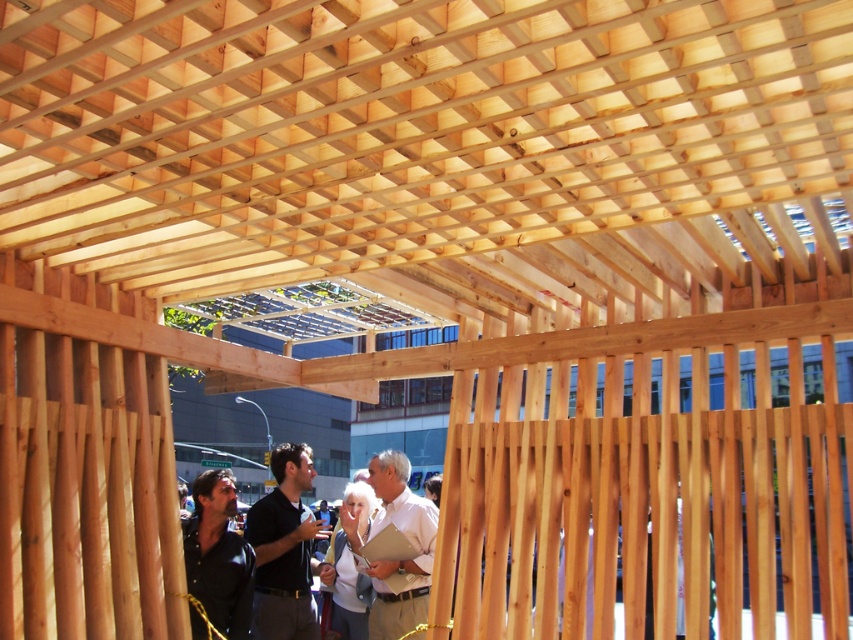
Between black shirt at center and dark brown leather jacket at lower left, which one appears on the right side from the viewer's perspective?

Positioned to the right is black shirt at center.

Measure the distance between point (256, 570) and camera.

Point (256, 570) is 6.52 meters from camera.

Does point (259, 506) lie behind point (221, 596)?

Yes, it is.

What are the coordinates of `black shirt at center` in the screenshot? It's located at click(x=283, y=548).

At what (x,y) coordinates should I click in order to perform the action: click on white matte shirt at center. Please return your answer as a coordinate pair (x, y). Looking at the image, I should click on (399, 560).

Is white matte shirt at center in front of dark brown leather jacket at lower left?

No, white matte shirt at center is further to the viewer.

Is point (376, 593) behind point (223, 540)?

That is True.

Where is `white matte shirt at center`? white matte shirt at center is located at coordinates (399, 560).

Who is positioned more to the right, black shirt at center or white matte shirt at center?

white matte shirt at center

Is black shirt at center behind white matte shirt at center?

No, it is not.

Is point (251, 508) positioned before point (410, 580)?

No, it is behind (410, 580).

The image size is (853, 640). I want to click on black shirt at center, so click(283, 548).